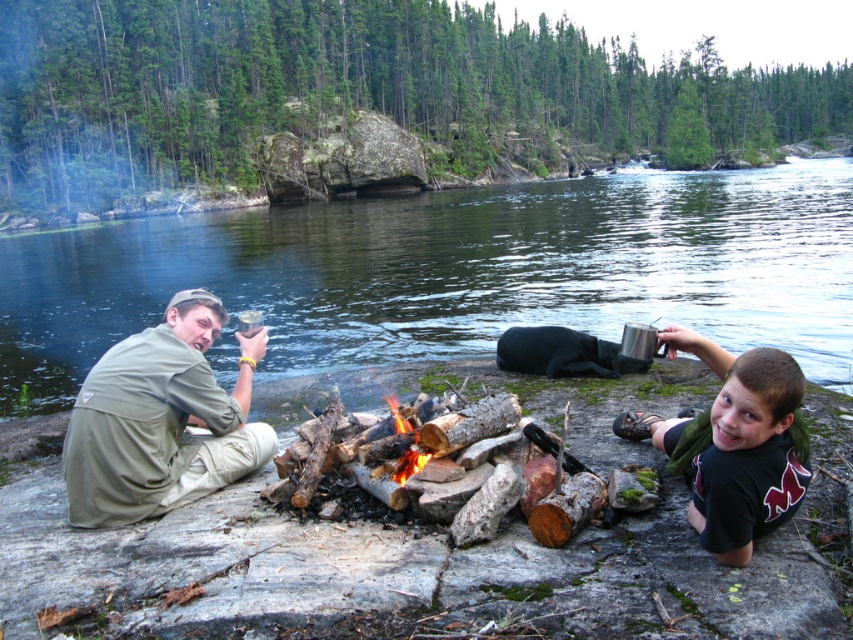
Does clear water at river center appear under green fabric shirt at left?

Incorrect, clear water at river center is not positioned below green fabric shirt at left.

Which is behind, point (479, 246) or point (152, 428)?

The point (479, 246) is behind.

Where is `clear water at river center`? The width and height of the screenshot is (853, 640). clear water at river center is located at coordinates (453, 273).

Can you confirm if green fabric shirt at left is thinner than black matte shirt at lower right?

No.

Identify the location of green fabric shirt at left. The height and width of the screenshot is (640, 853). (161, 419).

Which is behind, point (392, 324) or point (752, 442)?

The point (392, 324) is behind.

Is point (720, 340) less distant than point (718, 436)?

No, it is not.

Is point (724, 301) positioned behind point (769, 349)?

Yes.

Where is `clear water at river center`? The height and width of the screenshot is (640, 853). clear water at river center is located at coordinates (453, 273).